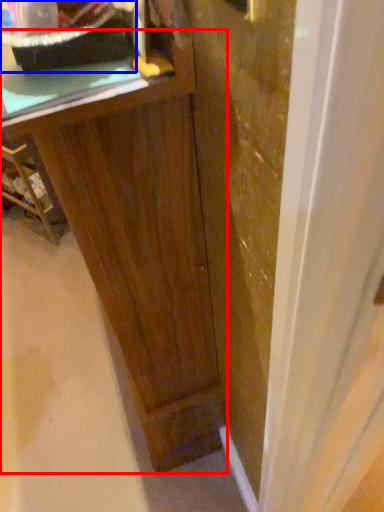
Question: Which object is further to the camera taking this photo, vanity (highlighted by a red box) or appliance (highlighted by a blue box)?

Choices:
 (A) vanity
 (B) appliance

Answer: (A)